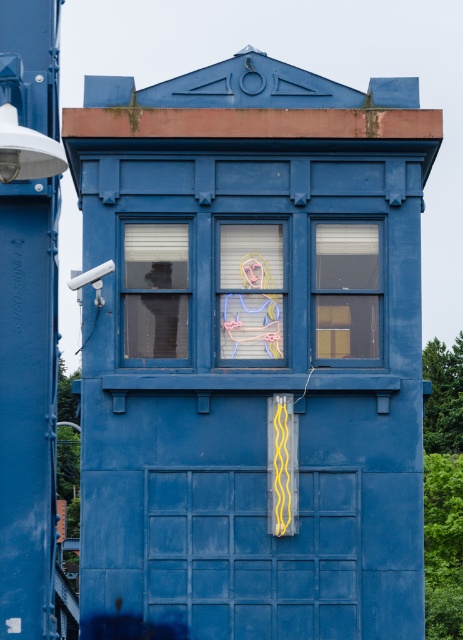
The image size is (463, 640). What do you see at coordinates (156, 289) in the screenshot? I see `matte glass window at center` at bounding box center [156, 289].

Who is higher up, matte glass window at center or pastel painted portrait at center?

matte glass window at center is higher up.

Between point (136, 228) and point (238, 275), which one is positioned behind?

The point (136, 228) is behind.

This screenshot has height=640, width=463. What are the coordinates of `matte glass window at center` in the screenshot? It's located at (156, 289).

Consider the image. Can you confirm if matte glass window at center right is positioned to the left of pastel painted portrait at center?

In fact, matte glass window at center right is to the right of pastel painted portrait at center.

Does point (348, 348) come closer to viewer compared to point (251, 259)?

That is True.

Where is `matte glass window at center right`? The width and height of the screenshot is (463, 640). matte glass window at center right is located at coordinates (346, 289).

Which is below, matte glass window at center or matte glass window at center right?

matte glass window at center

The width and height of the screenshot is (463, 640). What are the coordinates of `matte glass window at center` in the screenshot? It's located at (156, 289).

Where is `matte glass window at center`? The height and width of the screenshot is (640, 463). matte glass window at center is located at coordinates (156, 289).